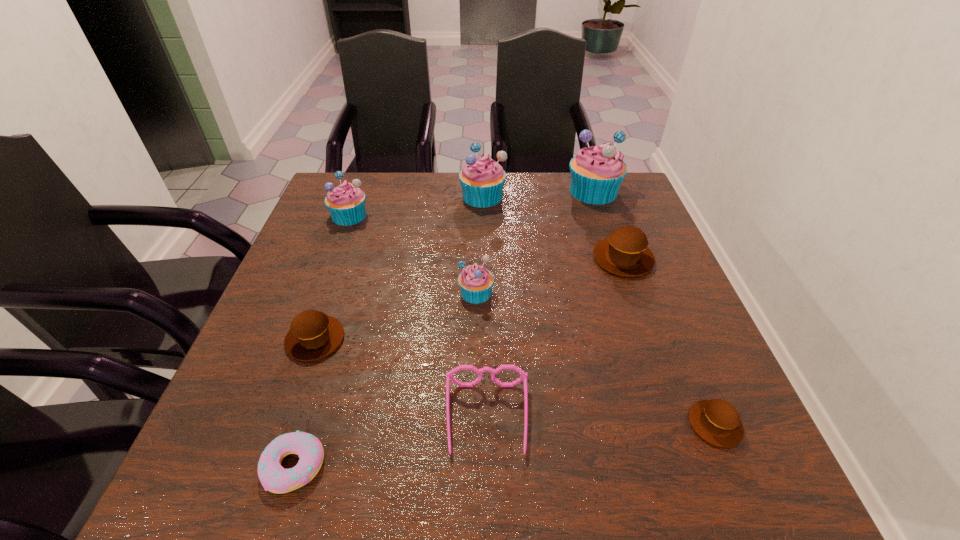
You are a GUI agent. You are given a task and a screenshot of the screen. Output one action in this format:
    pyautogui.click(x=<x>, y=<y>)
    Task: Click on the blue muffin that is the second closest one to the doughnut
    This screenshot has width=960, height=540.
    Given the screenshot: What is the action you would take?
    pyautogui.click(x=346, y=203)

The width and height of the screenshot is (960, 540). Identify the location of the second closest blue muffin to the fifth farthest muffin. (346, 203).

Point out which brown muffin is positioned as the nearest to the sixth tallest muffin. Please provide its 2D coordinates. Your answer should be formatted as a tuple, i.e. [(x, y)], where the tuple contains the x and y coordinates of a point satisfying the conditions above.

[(625, 252)]

The height and width of the screenshot is (540, 960). Identify the location of brown muffin that stands as the third closest to the rightmost blue muffin. (313, 335).

This screenshot has height=540, width=960. Find the location of `vacant space that satisfies the following two spatial constraints: 1. on the back side of the second tallest muffin; 2. on the left side of the second smallest blue muffin`. vacant space that satisfies the following two spatial constraints: 1. on the back side of the second tallest muffin; 2. on the left side of the second smallest blue muffin is located at coordinates (356, 196).

This screenshot has height=540, width=960. In order to click on free point that satisfies the following two spatial constraints: 1. on the arms of the spectacles; 2. on the right side of the shortest muffin in this screenshot , I will do `click(487, 424)`.